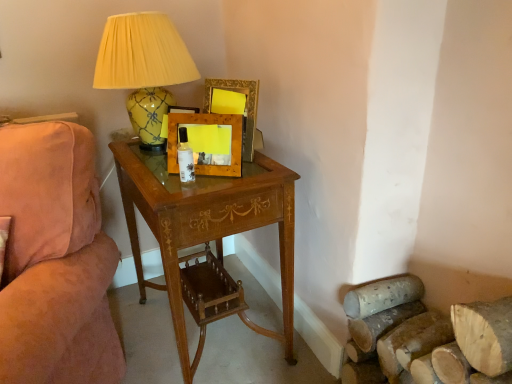
Question: From the image's perspective, relative to yellow glossy ceramic lamp at upper left, is wooden desk at center above or below?

Choices:
 (A) below
 (B) above

Answer: (A)

Question: Is wooden desk at center wider or thinner than yellow glossy ceramic lamp at upper left?

Choices:
 (A) wide
 (B) thin

Answer: (A)

Question: Which of these objects is positioned farthest from the wooden picture frame at center, marked as the first picture frame in a front-to-back arrangement?

Choices:
 (A) yellow glossy ceramic lamp at upper left
 (B) wooden picture frame at upper center, which appears as the 1th picture frame when viewed from the back
 (C) wooden desk at center
 (D) suede pink couch at left

Answer: (D)

Question: Which object is positioned closest to the wooden picture frame at upper center, placed as the second picture frame when sorted from front to back?

Choices:
 (A) wooden picture frame at center, marked as the 2th picture frame in a back-to-front arrangement
 (B) suede pink couch at left
 (C) yellow glossy ceramic lamp at upper left
 (D) wooden desk at center

Answer: (A)